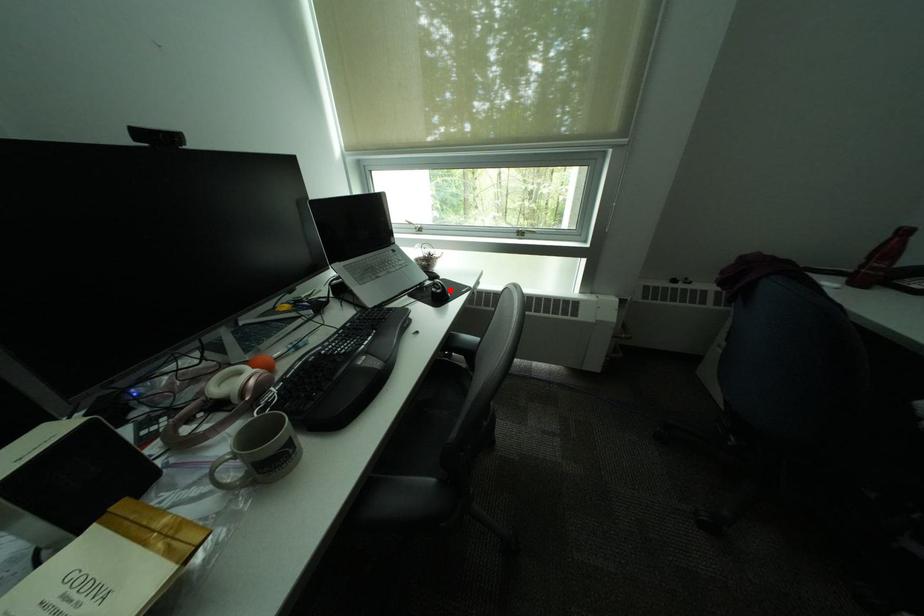
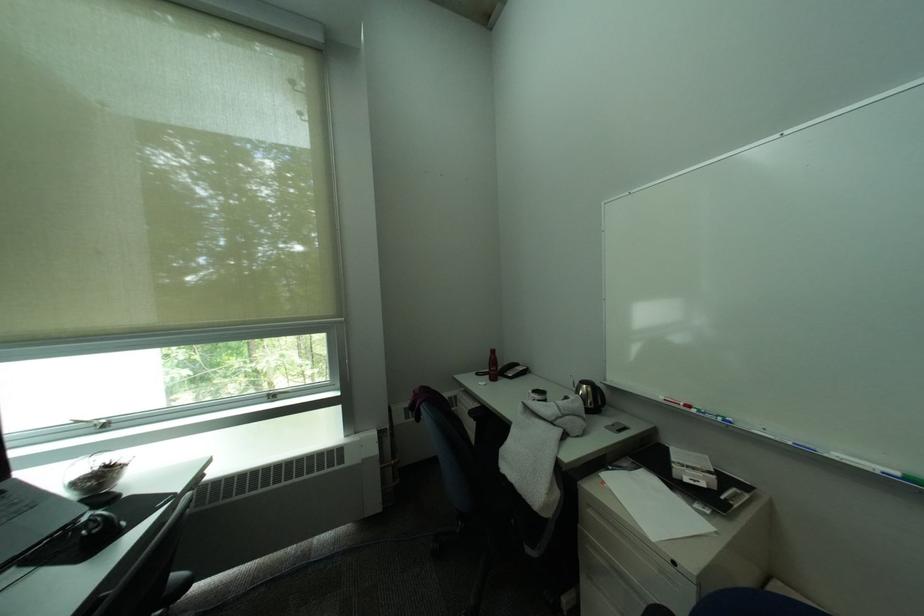
The point at the highlighted location is marked in the first image. Where is the corresponding point in the second image?

(106, 528)